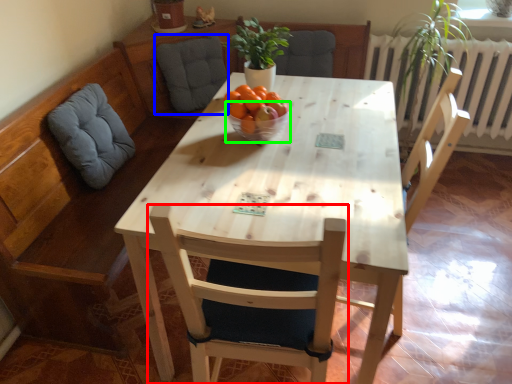
Question: Which object is the closest to the chair (highlighted by a red box)? Choose among these: swivel chair (highlighted by a blue box) or glass bowl (highlighted by a green box).

Choices:
 (A) swivel chair
 (B) glass bowl

Answer: (B)